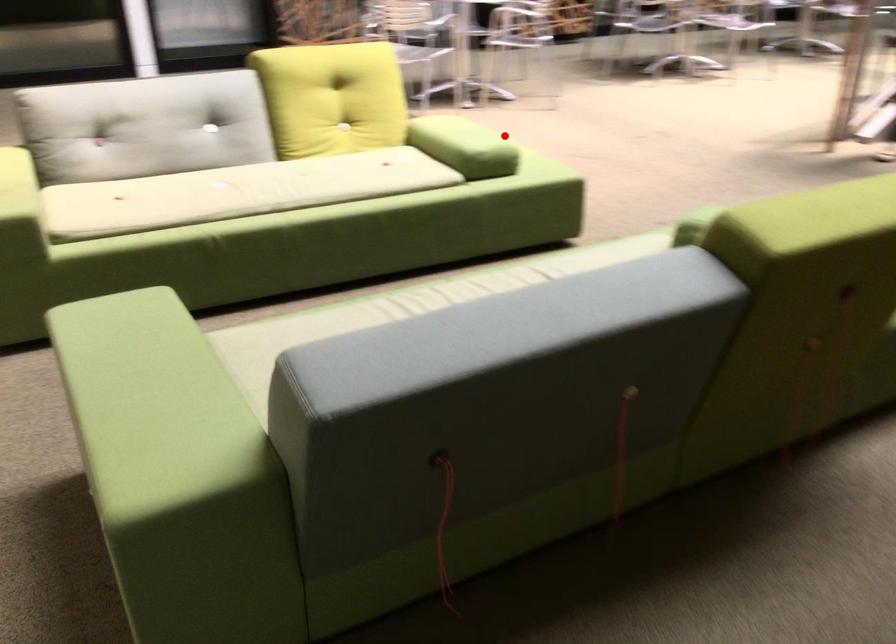
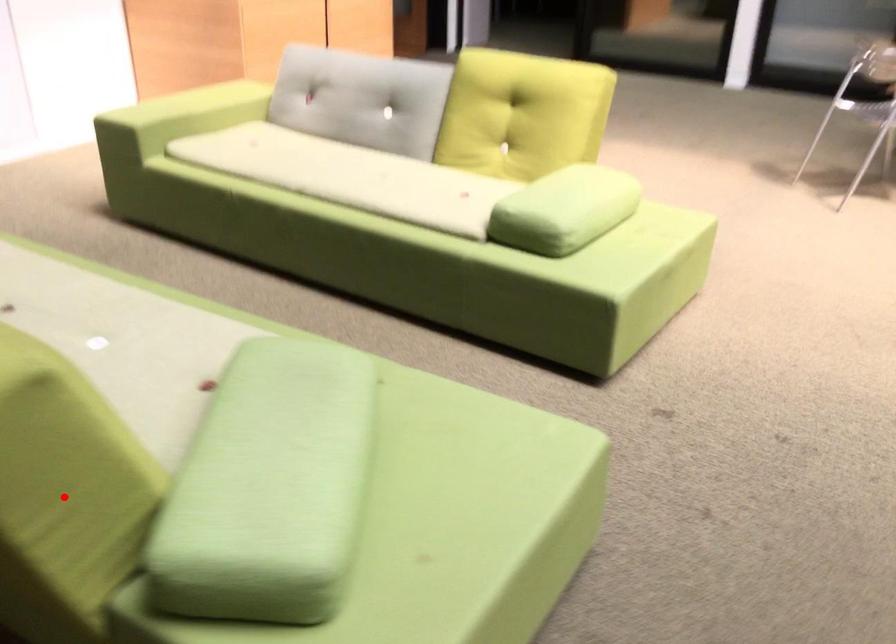
In the scene shown: I am providing you with two images of the same scene from different viewpoints. A red point is marked on the first image and another point is marked on the second image. Is the red point in image1 aligned with the point shown in image2?

No